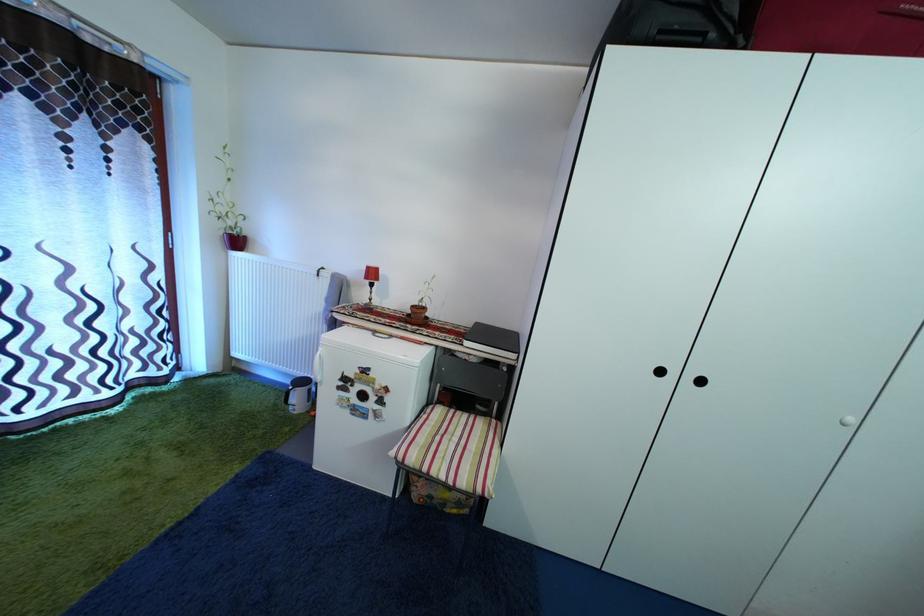
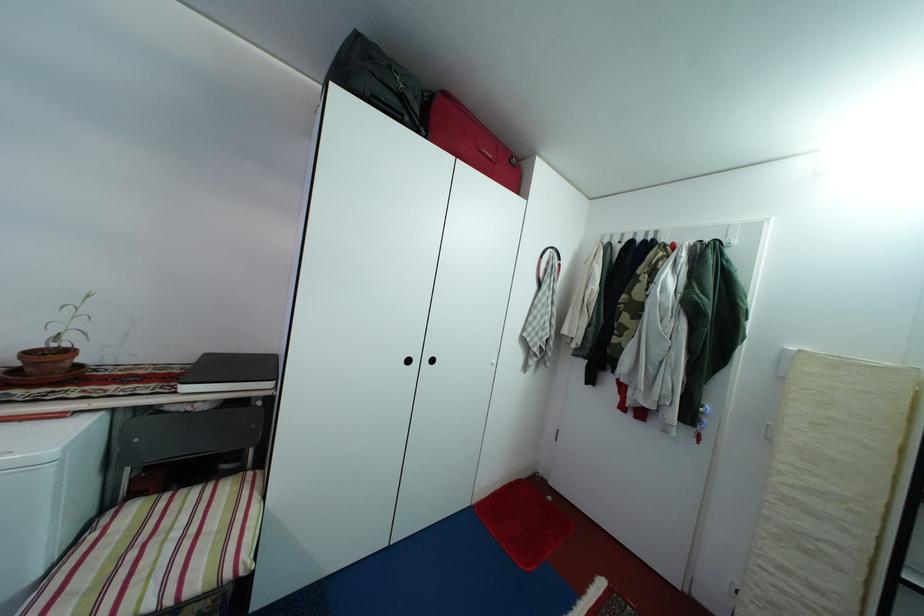
Find the pixel in the second image that matches the point at 714,42 in the first image.

(410, 123)